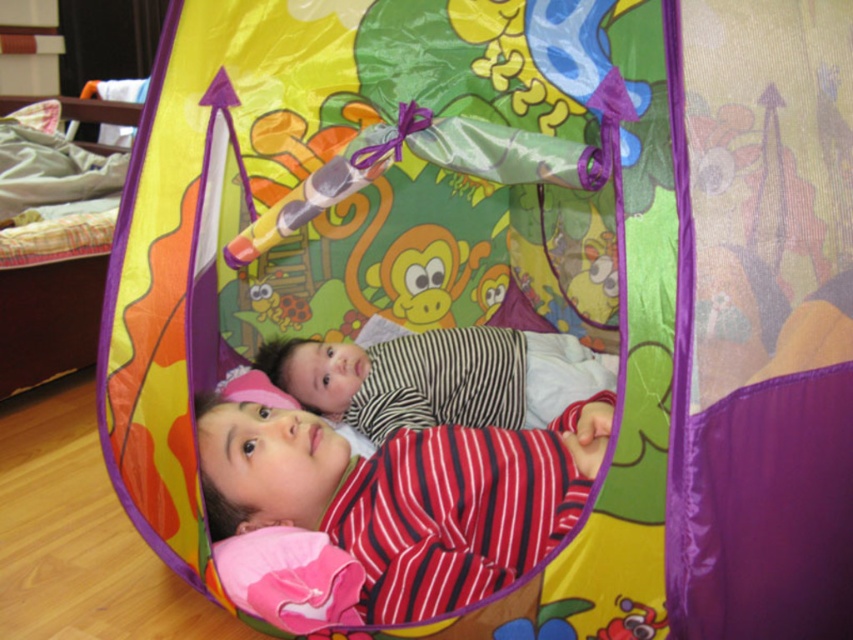
Question: Does striped fabric child at center have a larger size compared to striped fabric baby at center?

Choices:
 (A) no
 (B) yes

Answer: (B)

Question: Considering the relative positions of striped fabric child at center and striped fabric baby at center in the image provided, where is striped fabric child at center located with respect to striped fabric baby at center?

Choices:
 (A) above
 (B) below

Answer: (B)

Question: Observing the image, what is the correct spatial positioning of striped fabric child at center in reference to striped fabric baby at center?

Choices:
 (A) right
 (B) left

Answer: (B)

Question: Among these points, which one is nearest to the camera?

Choices:
 (A) (363, 410)
 (B) (575, 419)

Answer: (B)